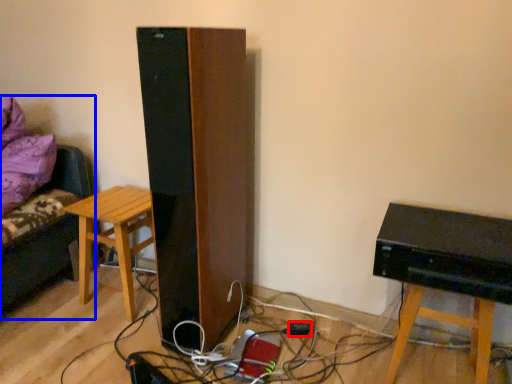
Question: Which point is further to the camera, plug (highlighted by a red box) or furniture (highlighted by a blue box)?

Choices:
 (A) plug
 (B) furniture

Answer: (A)